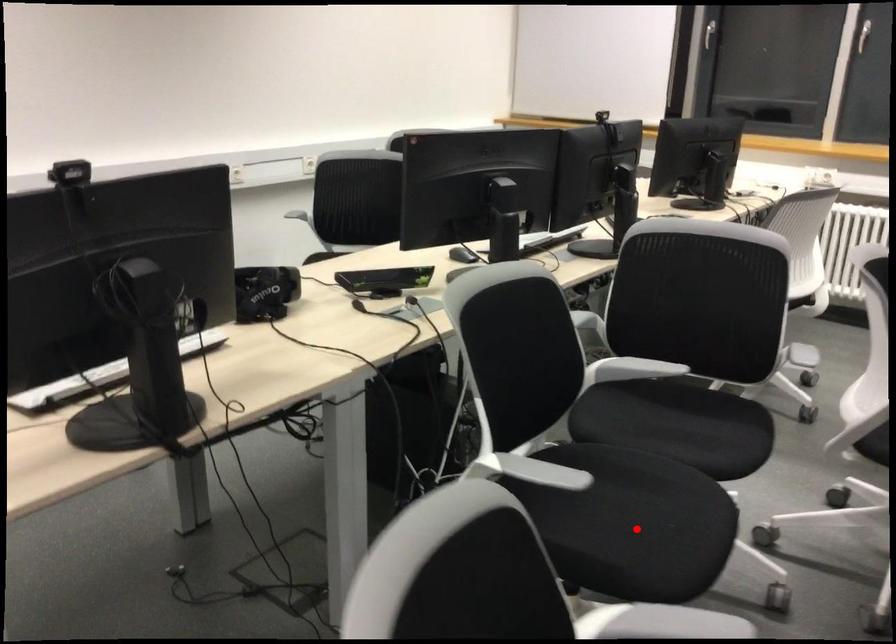
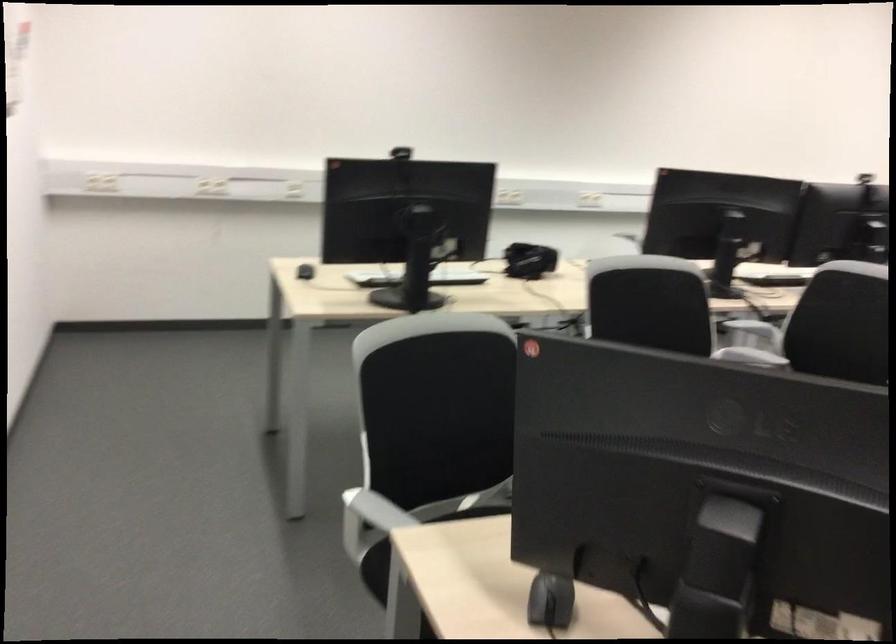
Question: I am providing you with two images of the same scene from different viewpoints. A red point is marked on the first image. At the location where the point appears in image 1, is it still visible in image 2?

Choices:
 (A) Yes
 (B) No

Answer: (B)